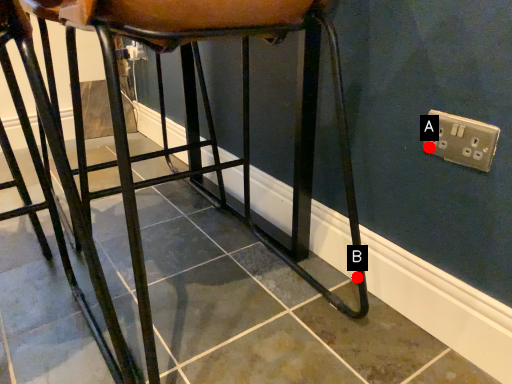
Question: Two points are circled on the image, labeled by A and B beside each circle. Which point is closer to the camera?

Choices:
 (A) A is closer
 (B) B is closer

Answer: (A)